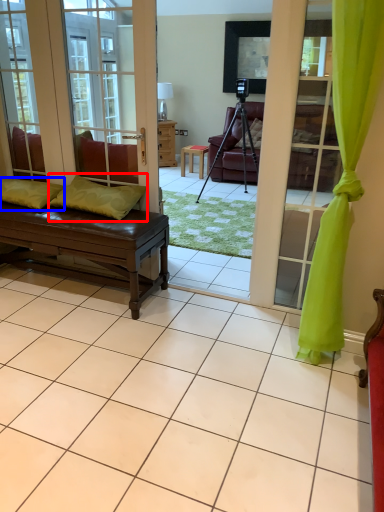
Question: Which of the following is the closest to the observer, pillow (highlighted by a red box) or pillow (highlighted by a blue box)?

Choices:
 (A) pillow
 (B) pillow

Answer: (A)